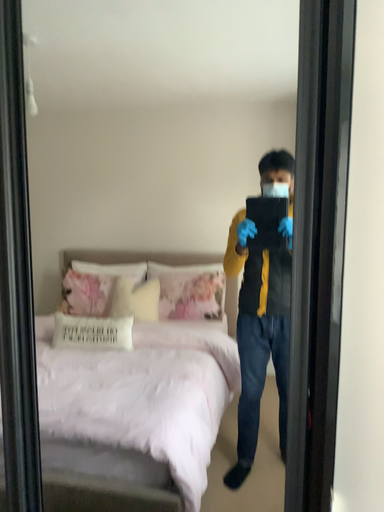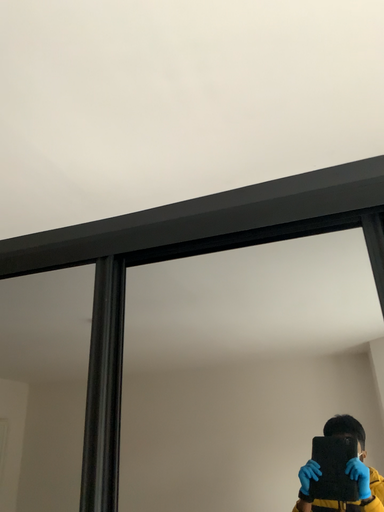
Question: How did the camera likely rotate when shooting the video?

Choices:
 (A) rotated upward
 (B) rotated downward

Answer: (A)